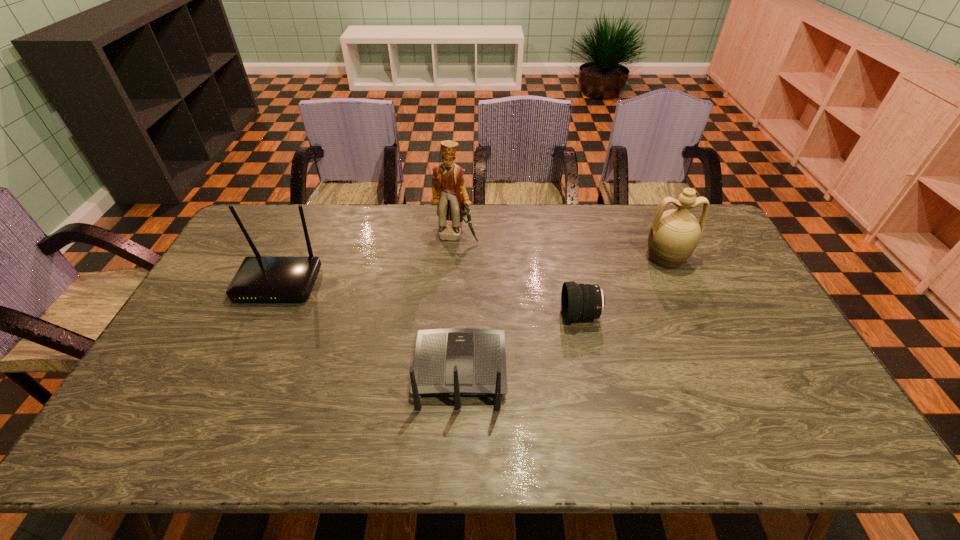
Locate an element on the screen. This screenshot has height=540, width=960. free space between the left router and the second shortest object is located at coordinates (370, 327).

Find the location of a particular element. This screenshot has width=960, height=540. vacant area that lies between the second object from right to left and the rightmost object is located at coordinates (623, 287).

Locate an element on the screen. Image resolution: width=960 pixels, height=540 pixels. vacant point located between the tallest object and the leftmost object is located at coordinates (368, 259).

The height and width of the screenshot is (540, 960). In order to click on empty space between the right router and the fourth object from left to right in this screenshot , I will do `click(520, 343)`.

Point out which object is positioned as the third nearest to the farther router. Please provide its 2D coordinates. Your answer should be formatted as a tuple, i.e. [(x, y)], where the tuple contains the x and y coordinates of a point satisfying the conditions above.

[(578, 301)]

Locate which object ranks fourth in proximity to the shorter router. Please provide its 2D coordinates. Your answer should be formatted as a tuple, i.e. [(x, y)], where the tuple contains the x and y coordinates of a point satisfying the conditions above.

[(674, 234)]

Where is `vacant region that satisfies the following two spatial constraints: 1. on the front side of the rightmost object; 2. at the front element of the fourth object from left to right`? The height and width of the screenshot is (540, 960). vacant region that satisfies the following two spatial constraints: 1. on the front side of the rightmost object; 2. at the front element of the fourth object from left to right is located at coordinates (691, 315).

Image resolution: width=960 pixels, height=540 pixels. Find the location of `vacant space that satisfies the following two spatial constraints: 1. on the front side of the pitcher; 2. at the front element of the fourth object from left to right`. vacant space that satisfies the following two spatial constraints: 1. on the front side of the pitcher; 2. at the front element of the fourth object from left to right is located at coordinates (691, 315).

This screenshot has height=540, width=960. I want to click on blank area in the image that satisfies the following two spatial constraints: 1. on the front-facing side of the right router; 2. on the left side of the rightmost object, so click(465, 258).